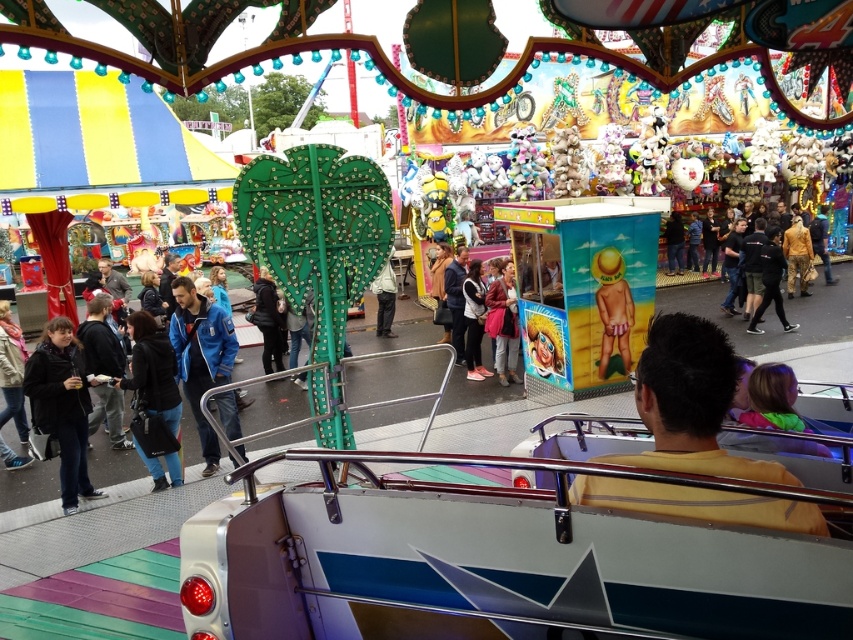
Question: Is yellow matte shirt at center wider than black leather jacket at lower left?

Choices:
 (A) yes
 (B) no

Answer: (A)

Question: Does black leather jacket at lower left appear on the left side of leather jacket at center?

Choices:
 (A) no
 (B) yes

Answer: (B)

Question: Which of the following is the closest to the observer?

Choices:
 (A) (494, 301)
 (B) (70, 394)
 (C) (155, 460)
 (D) (708, 403)

Answer: (D)

Question: Considering the real-world distances, which object is closest to the black leather jacket at lower left?

Choices:
 (A) leather jacket at center
 (B) black matte jacket at lower left
 (C) yellow matte shirt at center

Answer: (B)

Question: Is yellow matte shirt at center positioned in front of blue fabric jacket at center?

Choices:
 (A) yes
 (B) no

Answer: (A)

Question: Among these objects, which one is nearest to the camera?

Choices:
 (A) black matte jacket at lower left
 (B) yellow matte shirt at center
 (C) black leather jacket at lower left

Answer: (B)